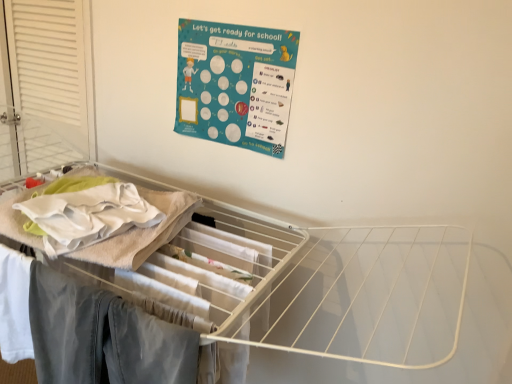
Question: Is denim pants at lower left taller or shorter than white wire drying rack at upper center?

Choices:
 (A) tall
 (B) short

Answer: (B)

Question: Based on their positions, is denim pants at lower left located to the left or right of white wire drying rack at upper center?

Choices:
 (A) left
 (B) right

Answer: (B)

Question: Which of these objects is positioned farthest from the white wire drying rack at upper center?

Choices:
 (A) teal paperboard poster at upper center
 (B) denim pants at lower left
 (C) white louvered screen door at left

Answer: (C)

Question: Which object is positioned farthest from the teal paperboard poster at upper center?

Choices:
 (A) denim pants at lower left
 (B) white louvered screen door at left
 (C) white wire drying rack at upper center

Answer: (A)